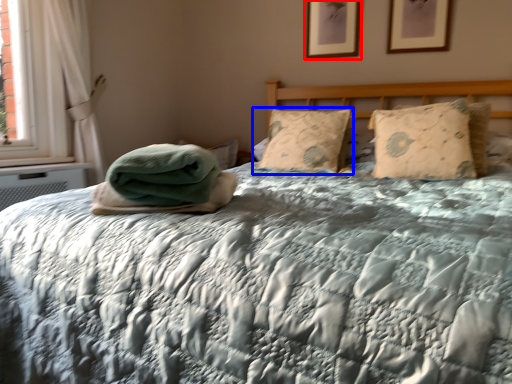
Question: Which object is further to the camera taking this photo, picture frame (highlighted by a red box) or pillow (highlighted by a blue box)?

Choices:
 (A) picture frame
 (B) pillow

Answer: (A)